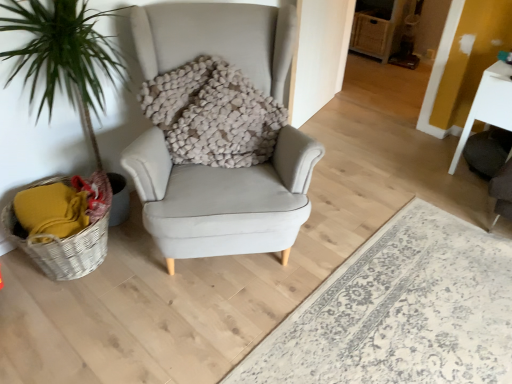
Question: Is light gray fabric armchair at center inside the boundaries of white glossy table at right, or outside?

Choices:
 (A) inside
 (B) outside

Answer: (B)

Question: From the image's perspective, is light gray fabric armchair at center positioned above or below white glossy table at right?

Choices:
 (A) below
 (B) above

Answer: (A)

Question: Which object is positioned closest to the light gray fabric armchair at center?

Choices:
 (A) fuzzy beige pillow at center
 (B) woven wicker basket at lower left
 (C) white glossy table at right

Answer: (A)

Question: Considering the real-world distances, which object is closest to the light gray fabric armchair at center?

Choices:
 (A) fuzzy beige pillow at center
 (B) white glossy table at right
 (C) woven wicker basket at lower left

Answer: (A)